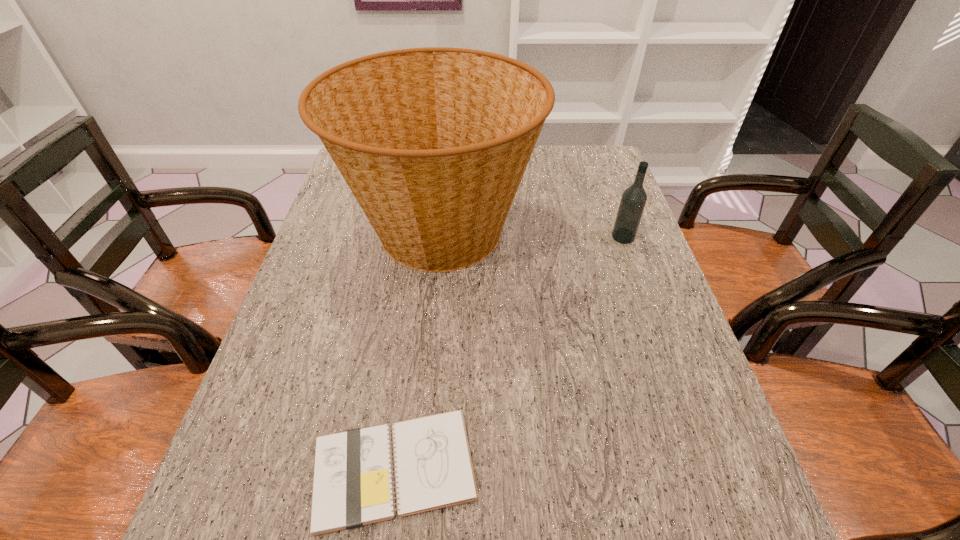
Find the location of a particular element. The width and height of the screenshot is (960, 540). free space between the notepad and the second tallest object is located at coordinates (509, 353).

You are a GUI agent. You are given a task and a screenshot of the screen. Output one action in this format:
    pyautogui.click(x=<x>, y=<y>)
    Task: Click on the free space between the vodka and the basket
    The image size is (960, 540).
    Given the screenshot: What is the action you would take?
    pyautogui.click(x=532, y=233)

This screenshot has width=960, height=540. What are the coordinates of `blank region between the notepad and the basket` in the screenshot? It's located at (417, 349).

Find the location of `free spot between the tallest object and the notepad`. free spot between the tallest object and the notepad is located at coordinates (417, 349).

I want to click on free point between the notepad and the vodka, so click(509, 353).

Where is `free space between the notepad and the tallest object`? The width and height of the screenshot is (960, 540). free space between the notepad and the tallest object is located at coordinates (417, 349).

Locate an element on the screen. vacant area between the second tallest object and the basket is located at coordinates (532, 233).

Locate an element on the screen. vacant space that's between the shortest object and the basket is located at coordinates (417, 349).

At what (x,y) coordinates should I click in order to perform the action: click on unoccupied position between the shortest object and the tallest object. Please return your answer as a coordinate pair (x, y). This screenshot has width=960, height=540. Looking at the image, I should click on coord(417,349).

Identify which object is the nearest to the tallest object. Please provide its 2D coordinates. Your answer should be formatted as a tuple, i.e. [(x, y)], where the tuple contains the x and y coordinates of a point satisfying the conditions above.

[(633, 200)]